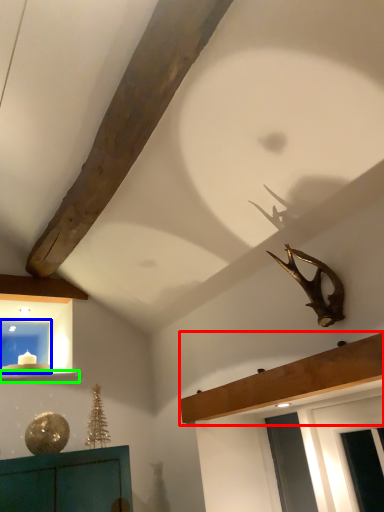
Question: Which object is the closest to the shelf (highlighted by a red box)? Choose among these: window (highlighted by a blue box) or window sill (highlighted by a green box).

Choices:
 (A) window
 (B) window sill

Answer: (B)